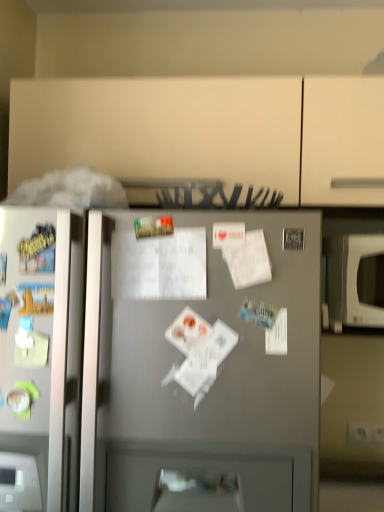
Question: Considering the positions of point (226, 346) and point (380, 275), is point (226, 346) closer or farther from the camera than point (380, 275)?

Choices:
 (A) closer
 (B) farther

Answer: (A)

Question: Looking at the image, does satin silver refrigerator at center seem bigger or smaller compared to white glossy microwave at right?

Choices:
 (A) big
 (B) small

Answer: (A)

Question: Estimate the real-world distances between objects in this image. Which object is farther from the satin silver refrigerator at center?

Choices:
 (A) white glossy microwave at right
 (B) white matte paper at center

Answer: (A)

Question: Considering the real-world distances, which object is closest to the satin silver refrigerator at center?

Choices:
 (A) white glossy microwave at right
 (B) white matte paper at center

Answer: (B)